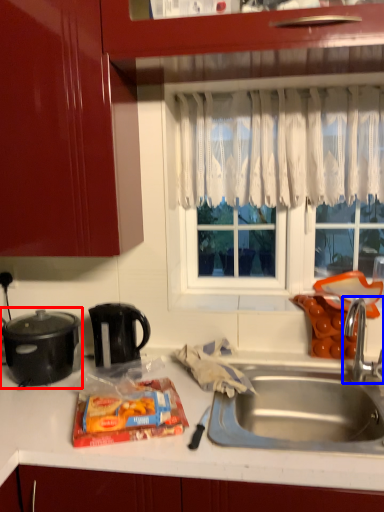
Question: Which object is further to the camera taking this photo, kitchen appliance (highlighted by a red box) or tap (highlighted by a blue box)?

Choices:
 (A) kitchen appliance
 (B) tap

Answer: (A)